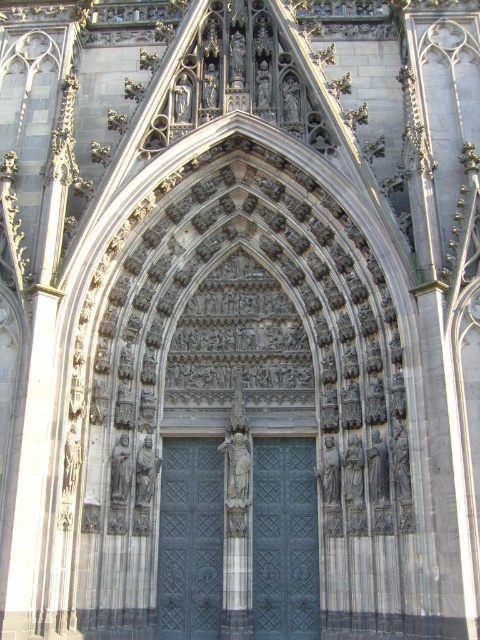
Who is lower down, dark blue metal door at center or dark gray metal door at center?

dark gray metal door at center is lower down.

Can you confirm if dark blue metal door at center is bigger than dark gray metal door at center?

Yes, dark blue metal door at center is bigger than dark gray metal door at center.

Who is more forward, (276, 472) or (202, 554)?

Point (202, 554) is in front.

The image size is (480, 640). In order to click on dark blue metal door at center in this screenshot , I will do `click(285, 540)`.